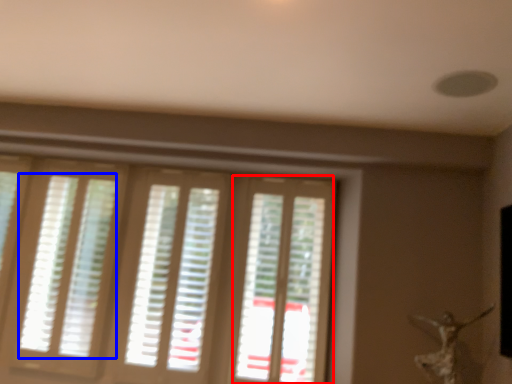
Question: Among these objects, which one is nearest to the camera, screen door (highlighted by a red box) or blind (highlighted by a blue box)?

Choices:
 (A) screen door
 (B) blind

Answer: (A)